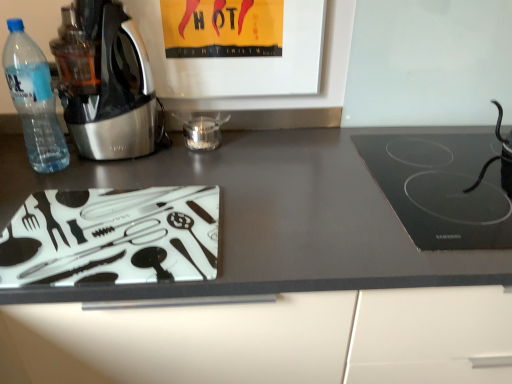
The image size is (512, 384). In order to click on vacant area that lies to the right of transparent glass jar at center, arranged as the first appliance when viewed from the left in this screenshot , I will do `click(271, 143)`.